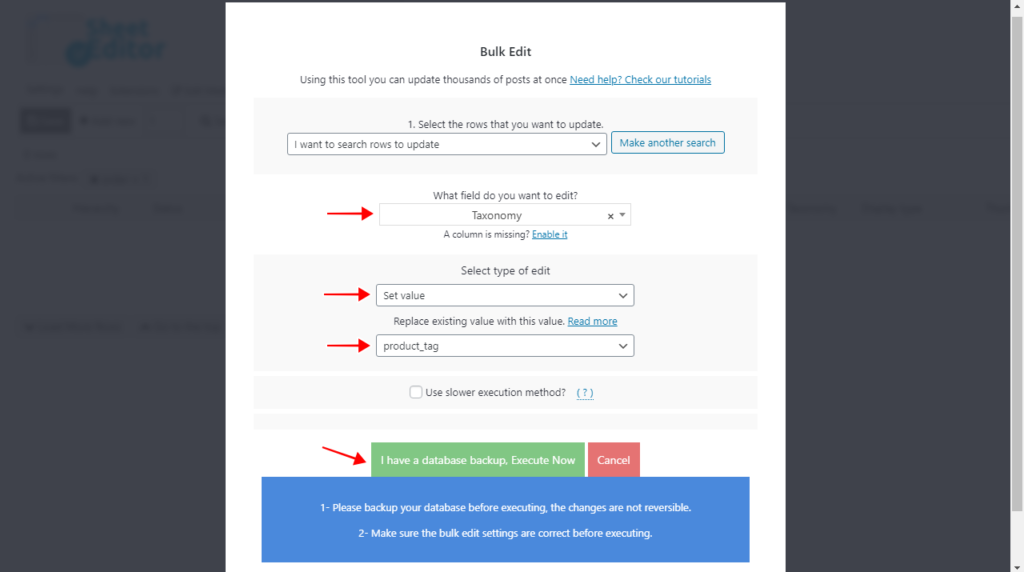
Identify the location of red cancel button. (622, 448).